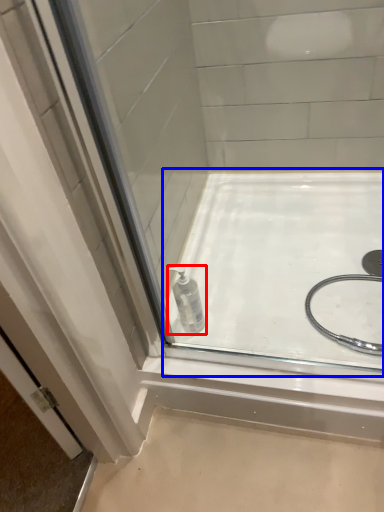
Question: Which object appears farthest to the camera in this image, bottle (highlighted by a red box) or bath (highlighted by a blue box)?

Choices:
 (A) bottle
 (B) bath

Answer: (A)